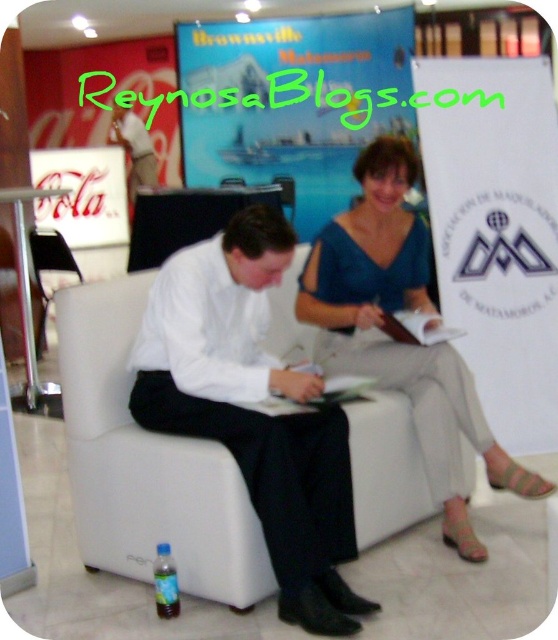
You are a photographer setting up for an event. You need to ensure that both the white smooth shirt at center and the blue satin blouse at center are visible in your shot. Based on their sizes, which one might require more careful framing to avoid being cut off?

The blue satin blouse at center occupies more space than the white smooth shirt at center, so it might require more careful framing to avoid being cut off.

Consider the image. You are a photographer standing at the entrance of the room. You need to capture a photo where the white smooth shirt at center is in focus. Which direction should you aim your camera to ensure the shirt is centered in the frame?

The white smooth shirt at center is located at point 0.642 on the x and 0.455 on the y coordinates, so you should aim your camera towards those coordinates to center it in the frame.